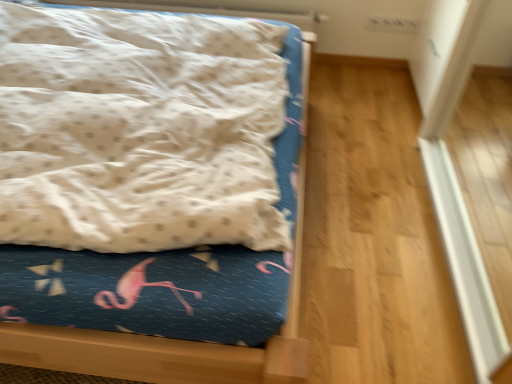
What do you see at coordinates (176, 339) in the screenshot?
I see `blue fabric bed at left` at bounding box center [176, 339].

Locate an element on the screen. The image size is (512, 384). blue fabric bed at left is located at coordinates [176, 339].

This screenshot has width=512, height=384. Identify the location of blue fabric bed at left. [176, 339].